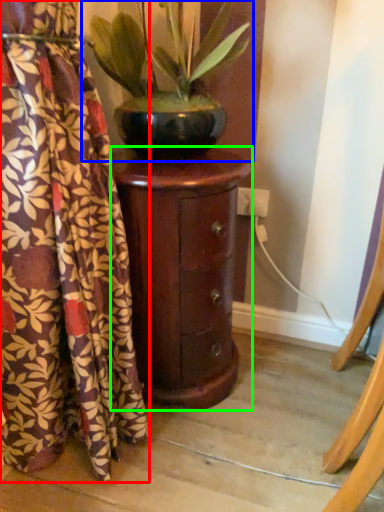
Question: Estimate the real-world distances between objects in this image. Which object is closer to curtain (highlighted by a red box), houseplant (highlighted by a blue box) or furniture (highlighted by a green box)?

Choices:
 (A) houseplant
 (B) furniture

Answer: (B)